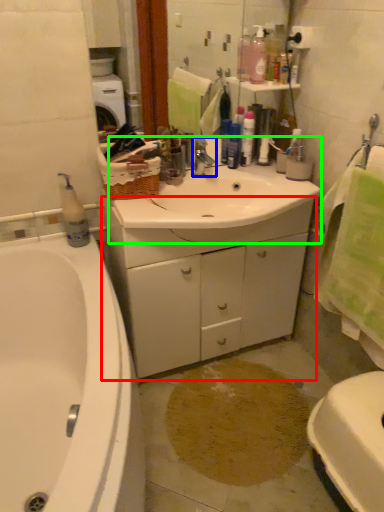
Question: Which is farther away from cabinetry (highlighted by a red box)? tap (highlighted by a blue box) or sink (highlighted by a green box)?

Choices:
 (A) tap
 (B) sink

Answer: (A)